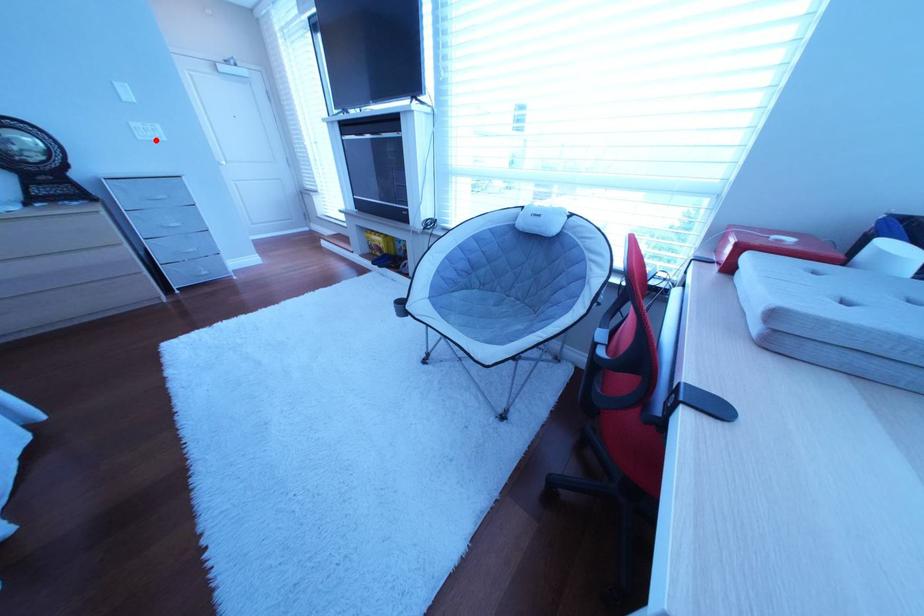
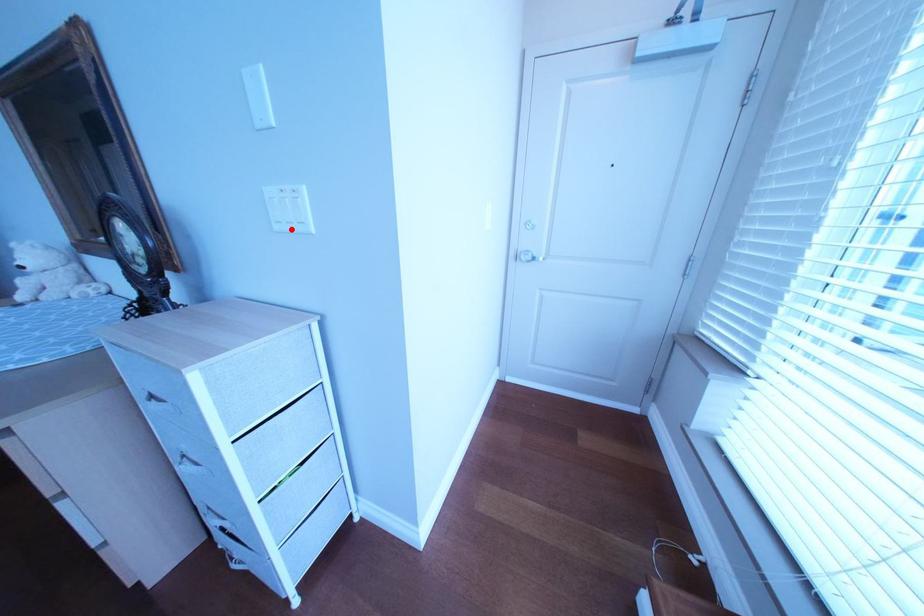
I am providing you with two images of the same scene from different viewpoints. A red point is marked on the first image and another point is marked on the second image. Is the red point in image1 aligned with the point shown in image2?

Yes